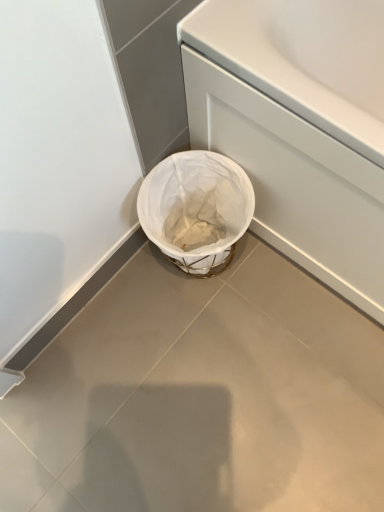
Question: Would you say white fabric basket at lower center is to the left or to the right of white matte bath at lower right in the picture?

Choices:
 (A) left
 (B) right

Answer: (A)

Question: Looking at the image, does white fabric basket at lower center seem bigger or smaller compared to white matte bath at lower right?

Choices:
 (A) small
 (B) big

Answer: (A)

Question: Which object is positioned farthest from the white matte bath at lower right?

Choices:
 (A) white fabric basket at lower center
 (B) white fabric basket at lower center

Answer: (B)

Question: Which is farther from the white matte bath at lower right?

Choices:
 (A) white fabric basket at lower center
 (B) white fabric basket at lower center

Answer: (B)